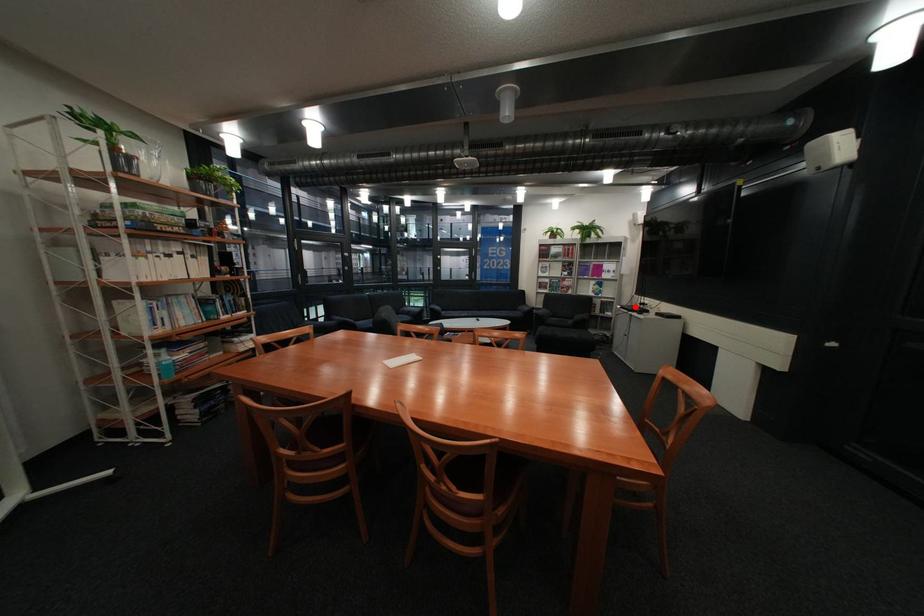
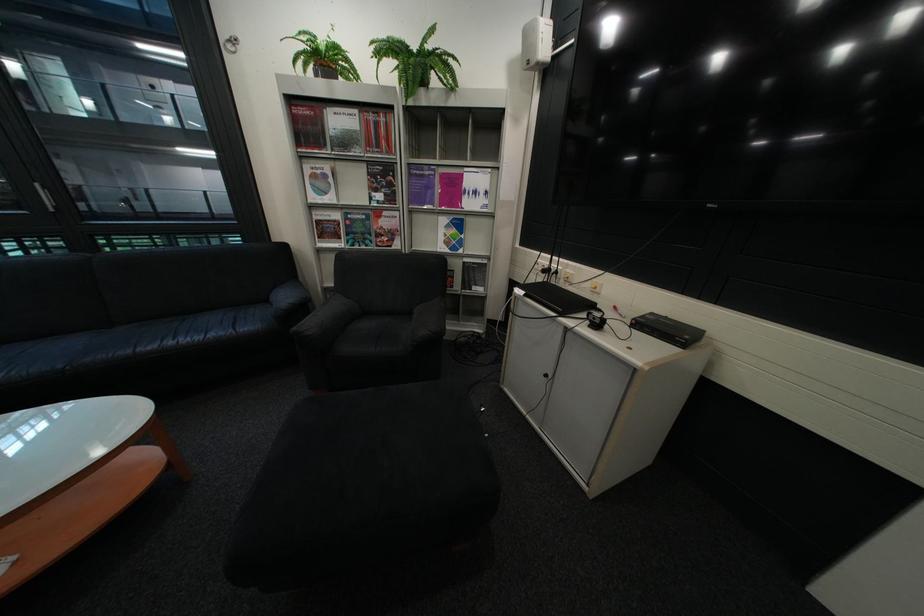
The point at the highlighted location is marked in the first image. Where is the corresponding point in the second image?

(538, 293)